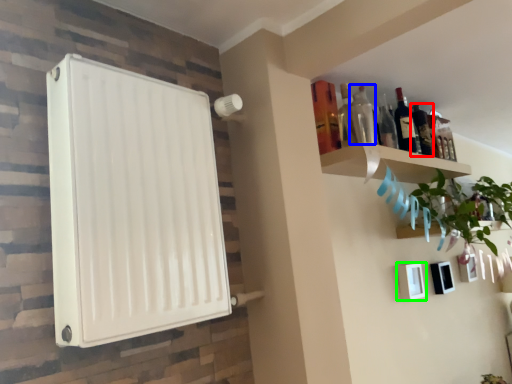
Question: Which object is the farthest from bottle (highlighted by a red box)? Choose among these: bottle (highlighted by a blue box) or picture frame (highlighted by a green box).

Choices:
 (A) bottle
 (B) picture frame

Answer: (B)